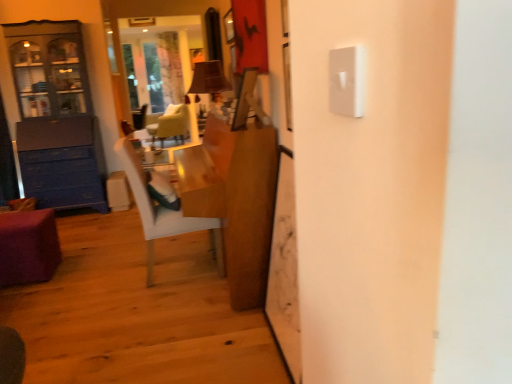
What are the coordinates of `vacant space to the right of purple fabric ottoman at lower left` in the screenshot? It's located at (76, 267).